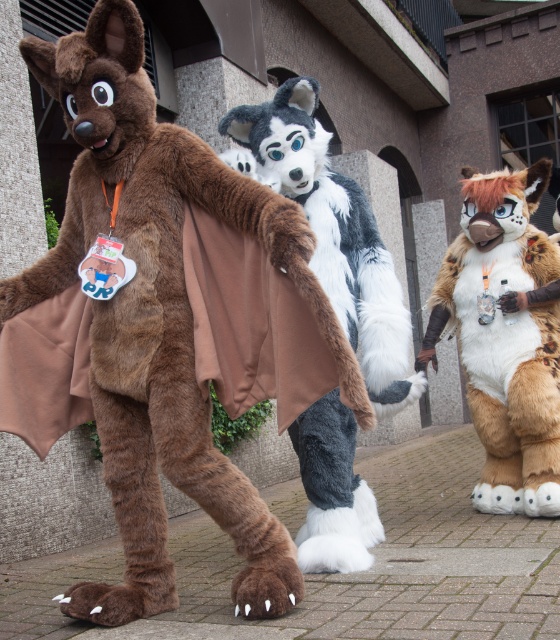
You are standing in front of the modern building with the three fursuiters. You want to take a photo of the fluffy fur wolf at center without getting too close. If you stay where you are, will you be able to capture the entire wolf in the frame of your smartphone camera?

The fluffy fur wolf at center and viewer are 3.20 meters apart from each other. Since smartphones typically have a wide enough angle to capture a subject at that distance, you should be able to fit the entire wolf in the frame without moving closer.

Looking at this image, you are organizing a photo shoot for a group of cosplayers. You need to arrange them so that the smaller character is in front to be visible. Which of the two, the brown furry costume at left or the fluffy fur wolf at center, should be placed in front?

The fluffy fur wolf at center should be placed in front because it is smaller in size compared to the brown furry costume at left, allowing it to be more visible without being obscured by the larger costume.